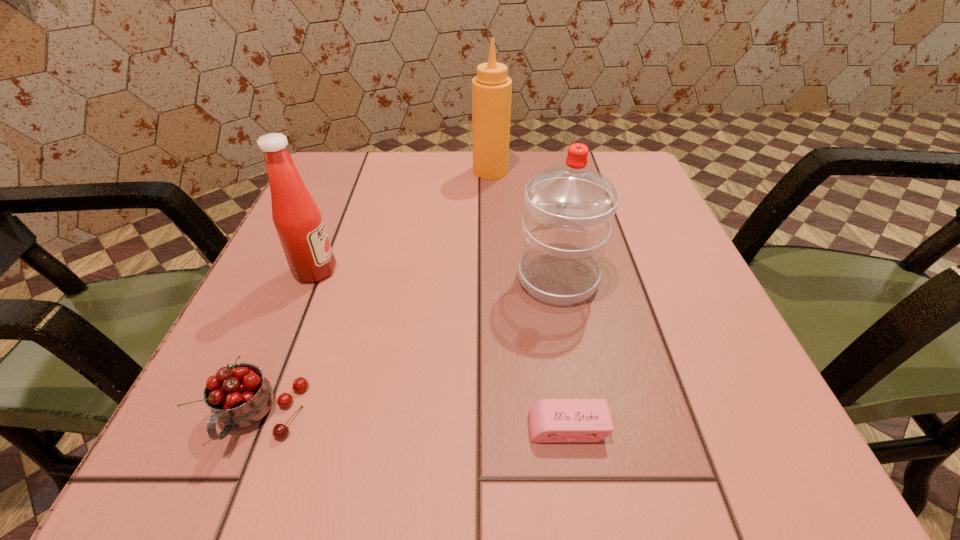
What are the coordinates of `the right condiment` in the screenshot? It's located at (491, 88).

The width and height of the screenshot is (960, 540). Find the location of `the farthest object`. the farthest object is located at coordinates tap(491, 88).

The width and height of the screenshot is (960, 540). I want to click on the left condiment, so click(x=297, y=219).

This screenshot has width=960, height=540. Identify the location of water bottle. (569, 209).

Image resolution: width=960 pixels, height=540 pixels. I want to click on cherry, so click(239, 396).

At what (x,y) coordinates should I click in order to perform the action: click on eraser. Please return your answer as a coordinate pair (x, y). The width and height of the screenshot is (960, 540). Looking at the image, I should click on (550, 420).

Where is `free point located 0.300m on the right of the right condiment`? free point located 0.300m on the right of the right condiment is located at coordinates (640, 171).

This screenshot has width=960, height=540. Identify the location of vacant space located on the front-facing side of the left condiment. (423, 271).

Image resolution: width=960 pixels, height=540 pixels. I want to click on free space located 0.120m on the handle side of the water bottle, so click(x=546, y=214).

Where is `vacant space located on the handle side of the water bottle`? The height and width of the screenshot is (540, 960). vacant space located on the handle side of the water bottle is located at coordinates (544, 208).